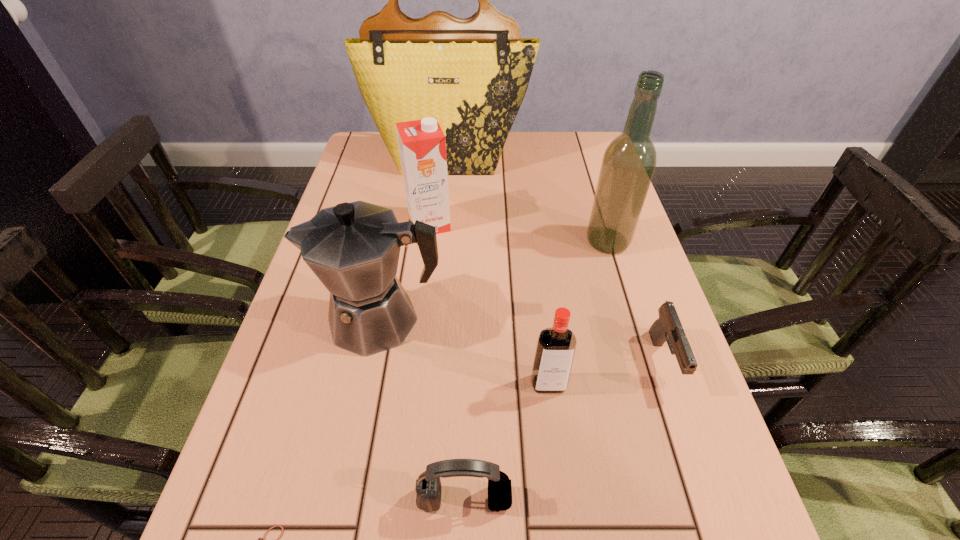
The height and width of the screenshot is (540, 960). Identify the location of vacant space at the far edge of the desktop. (536, 154).

In the image, there is a desktop. Identify the location of vacant space at the left edge. This screenshot has height=540, width=960. (251, 448).

In the image, there is a desktop. Where is `free space at the right edge`? free space at the right edge is located at coordinates (588, 258).

Image resolution: width=960 pixels, height=540 pixels. Identify the location of vacant point at the far left corner. (370, 133).

The height and width of the screenshot is (540, 960). I want to click on empty location between the seventh tallest object and the coffeepot, so click(x=522, y=340).

Where is `free space between the fifth tallest object and the carton`? free space between the fifth tallest object and the carton is located at coordinates (489, 304).

In order to click on empty space between the third shortest object and the second shortest object in this screenshot , I will do pyautogui.click(x=564, y=430).

Where is `vacant area that lies between the tote bag and the vodka`? vacant area that lies between the tote bag and the vodka is located at coordinates (498, 271).

Find the location of a particular element. The width and height of the screenshot is (960, 540). empty space between the coffeepot and the headset is located at coordinates (422, 409).

Locate an element on the screen. This screenshot has height=540, width=960. free space between the third shortest object and the vodka is located at coordinates (507, 442).